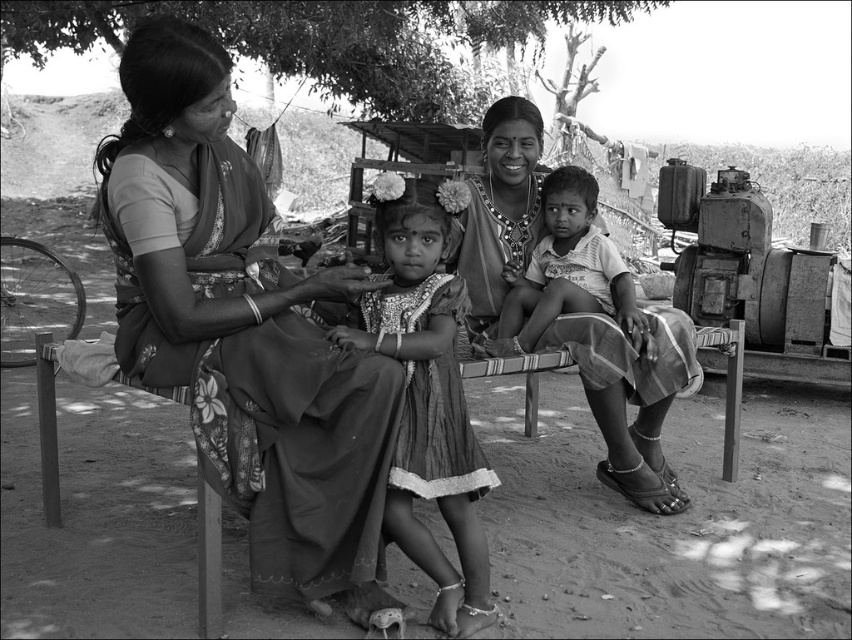
Does floral-patterned fabric at left have a lesser height compared to smooth fabric child at center?

In fact, floral-patterned fabric at left may be taller than smooth fabric child at center.

Between point (249, 484) and point (577, 308), which one is positioned behind?

Positioned behind is point (577, 308).

This screenshot has height=640, width=852. What do you see at coordinates (243, 330) in the screenshot? I see `floral-patterned fabric at left` at bounding box center [243, 330].

The height and width of the screenshot is (640, 852). I want to click on floral-patterned fabric at left, so [x=243, y=330].

Is point (170, 376) in front of point (426, 419)?

Yes, it is.

Looking at this image, how much distance is there between floral-patterned fabric at left and textured fabric dress at center?

13.23 inches

At what (x,y) coordinates should I click in order to perform the action: click on floral-patterned fabric at left. Please return your answer as a coordinate pair (x, y). The width and height of the screenshot is (852, 640). Looking at the image, I should click on (243, 330).

Between point (448, 180) and point (551, 275), which one is positioned in front?

Point (448, 180) is in front.

What do you see at coordinates (429, 400) in the screenshot? I see `textured fabric dress at center` at bounding box center [429, 400].

Measure the distance between point (478,448) and camera.

8.69 feet

This screenshot has width=852, height=640. I want to click on textured fabric dress at center, so click(429, 400).